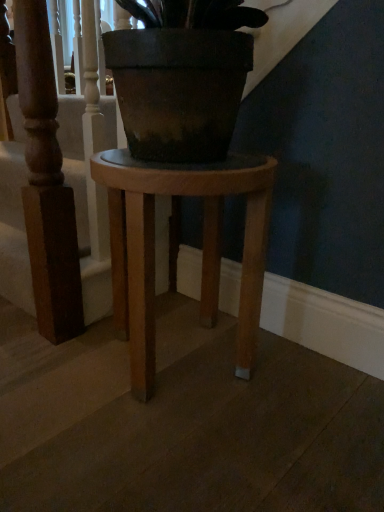
Locate an element on the screen. This screenshot has height=512, width=384. vacant space underneath wooden stool at center (from a real-world perspective) is located at coordinates (181, 358).